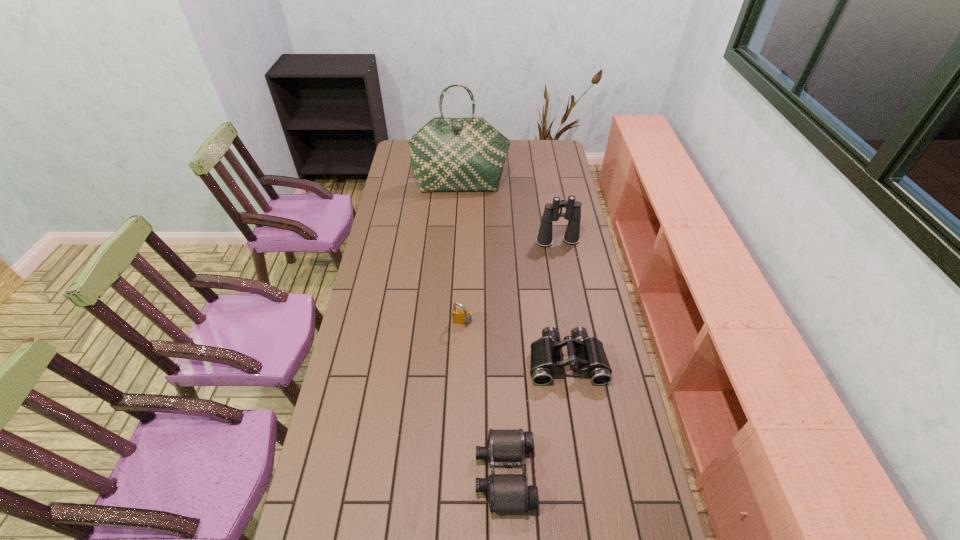
Identify which object is the second nearest to the shortest object. Please provide its 2D coordinates. Your answer should be formatted as a tuple, i.e. [(x, y)], where the tuple contains the x and y coordinates of a point satisfying the conditions above.

[(459, 316)]

Identify the location of object that is the closest one to the shortest object. The image size is (960, 540). (588, 353).

Where is `binoculars identified as the closest to the padlock`? This screenshot has height=540, width=960. binoculars identified as the closest to the padlock is located at coordinates [588, 353].

At what (x,y) coordinates should I click in order to perform the action: click on the closest binoculars to the second farthest binoculars. Please return your answer as a coordinate pair (x, y). Image resolution: width=960 pixels, height=540 pixels. Looking at the image, I should click on (505, 448).